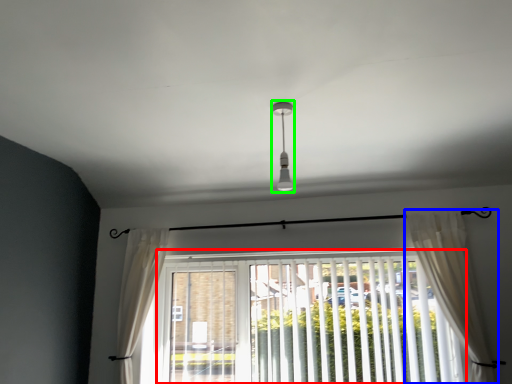
Question: Which object is the closest to the window blind (highlighted by a red box)? Choose among these: curtain (highlighted by a blue box) or light fixture (highlighted by a green box).

Choices:
 (A) curtain
 (B) light fixture

Answer: (A)